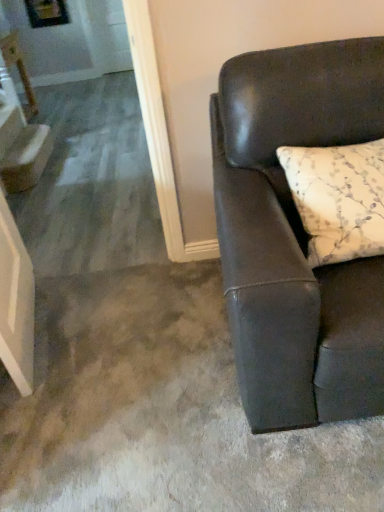
Question: From a real-world perspective, is white glossy step at left physically below matte black couch at right?

Choices:
 (A) yes
 (B) no

Answer: (A)

Question: Is white glossy step at left oriented towards matte black couch at right?

Choices:
 (A) no
 (B) yes

Answer: (A)

Question: Does white glossy step at left have a smaller size compared to matte black couch at right?

Choices:
 (A) yes
 (B) no

Answer: (A)

Question: Can you confirm if white glossy step at left is bigger than matte black couch at right?

Choices:
 (A) yes
 (B) no

Answer: (B)

Question: Is white glossy step at left further to camera compared to matte black couch at right?

Choices:
 (A) yes
 (B) no

Answer: (A)

Question: From a real-world perspective, is white glossy step at left located higher than matte black couch at right?

Choices:
 (A) yes
 (B) no

Answer: (B)

Question: Considering the relative sizes of white glossy step at left and matte white table at upper left in the image provided, is white glossy step at left wider than matte white table at upper left?

Choices:
 (A) no
 (B) yes

Answer: (A)

Question: Is the depth of white glossy step at left greater than that of matte white table at upper left?

Choices:
 (A) no
 (B) yes

Answer: (A)

Question: Does white glossy step at left have a lesser width compared to matte white table at upper left?

Choices:
 (A) no
 (B) yes

Answer: (B)

Question: Considering the relative sizes of white glossy step at left and matte white table at upper left in the image provided, is white glossy step at left smaller than matte white table at upper left?

Choices:
 (A) yes
 (B) no

Answer: (A)

Question: Does white glossy step at left have a greater height compared to matte white table at upper left?

Choices:
 (A) no
 (B) yes

Answer: (A)

Question: Considering the relative positions of white glossy step at left and matte white table at upper left in the image provided, is white glossy step at left to the left of matte white table at upper left from the viewer's perspective?

Choices:
 (A) yes
 (B) no

Answer: (B)

Question: Is white floral-patterned pillow at right next to white glossy step at left?

Choices:
 (A) no
 (B) yes

Answer: (A)